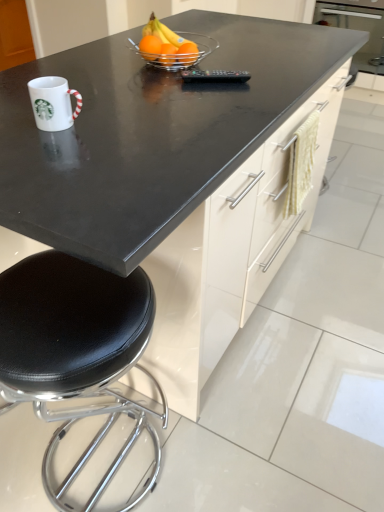
Find the location of `free space in front of white glossy mug at left`. free space in front of white glossy mug at left is located at coordinates (58, 153).